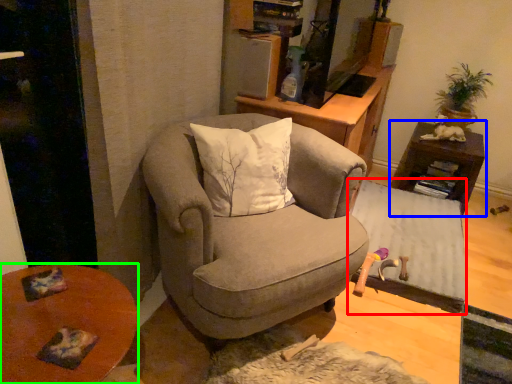
Question: Which is farther away from table (highlighted by a red box)? table (highlighted by a blue box) or desk (highlighted by a green box)?

Choices:
 (A) table
 (B) desk

Answer: (B)